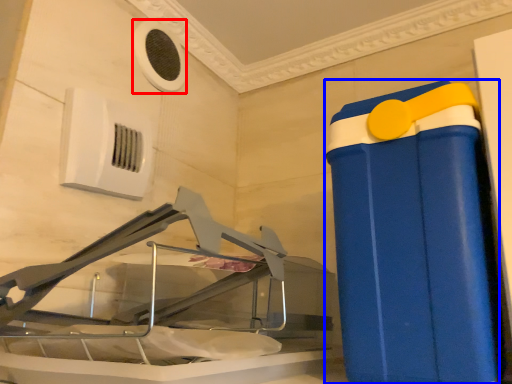
Question: Which point is further to the camera, air conditioning (highlighted by a red box) or waste container (highlighted by a blue box)?

Choices:
 (A) air conditioning
 (B) waste container

Answer: (A)